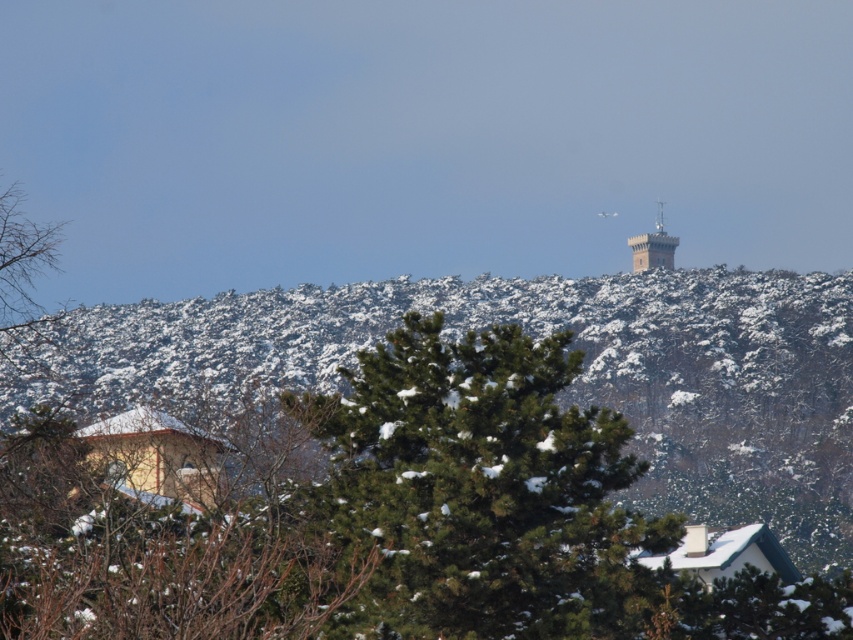
You are an architect designing a new observation deck. You want to place it in the winter landscape scene so that it can be seen from the green textured pine tree at center. Based on the scene description, should the observation deck be placed higher or lower than the brick tower at upper center to ensure visibility from the pine tree?

The green textured pine tree at center is shorter than the brick tower at upper center. To ensure visibility from the pine tree, the observation deck should be placed lower than the brick tower at upper center so that it can be seen over the shorter pine tree.

You are standing at the base of the evergreen tree in the winter landscape image. You notice two points marked on the image. One is at coordinates point (351, 600) and the other at point (640, 248). Which point is closer to you?

Point (351, 600) is in front of point (640, 248), so it is closer to you.

You are planning to build a cabin in the winter landscape shown. You want to place your cabin so that it is between the green textured pine tree at center and the brick tower at upper center. Is this possible?

The green textured pine tree at center is below the brick tower at upper center, so placing the cabin between them is possible as they are vertically aligned.